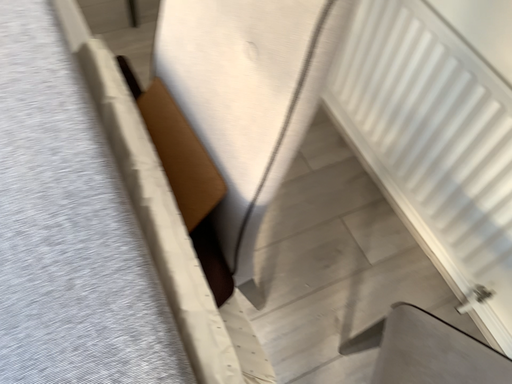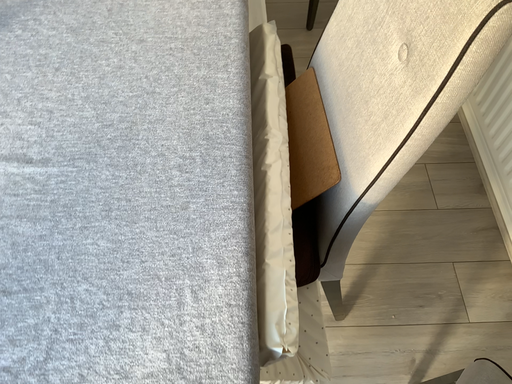
Question: How did the camera likely rotate when shooting the video?

Choices:
 (A) rotated left
 (B) rotated right

Answer: (A)